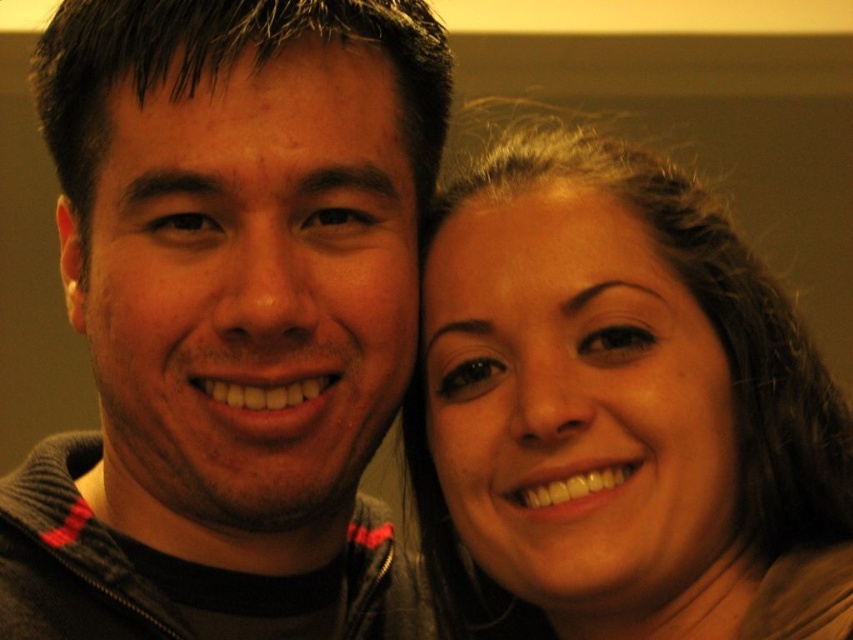
Question: Can you confirm if matte black jacket at left is wider than matte brown hair at right?

Choices:
 (A) no
 (B) yes

Answer: (B)

Question: Which object appears farthest from the camera in this image?

Choices:
 (A) matte brown hair at right
 (B) matte black jacket at left

Answer: (B)

Question: Does matte black jacket at left lie behind matte brown hair at right?

Choices:
 (A) no
 (B) yes

Answer: (B)

Question: Does matte black jacket at left have a lesser width compared to matte brown hair at right?

Choices:
 (A) yes
 (B) no

Answer: (B)

Question: Which of the following is the closest to the observer?

Choices:
 (A) (20, 561)
 (B) (460, 412)

Answer: (B)

Question: Which object is closer to the camera taking this photo?

Choices:
 (A) matte brown hair at right
 (B) matte black jacket at left

Answer: (A)